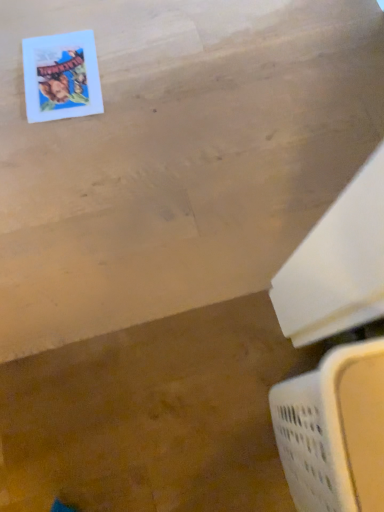
The width and height of the screenshot is (384, 512). What are the coordinates of `vacant area to the right of matte paper comic book at upper left` in the screenshot? It's located at (143, 75).